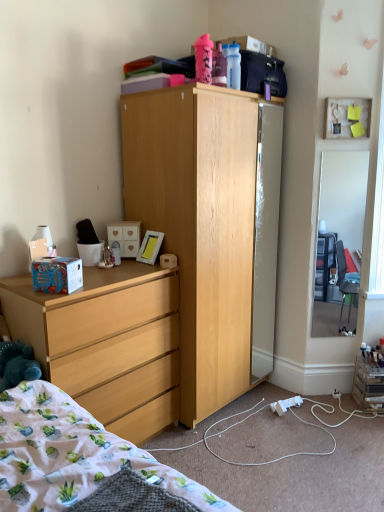
Question: In the image, is mirror glass refrigerator at center positioned in front of or behind blue cardboard box at left?

Choices:
 (A) front
 (B) behind

Answer: (B)

Question: In terms of width, does mirror glass refrigerator at center look wider or thinner when compared to blue cardboard box at left?

Choices:
 (A) wide
 (B) thin

Answer: (B)

Question: Estimate the real-world distances between objects in this image. Which object is farther from the velvety blue teddy bear at lower left?

Choices:
 (A) fluffy cotton blanket at lower left
 (B) clear glass mirror at right
 (C) white matte drawer at center
 (D) matte wood dresser at lower left
 (E) mirror glass refrigerator at center

Answer: (B)

Question: Which object is the closest to the mirror glass refrigerator at center?

Choices:
 (A) matte wood dresser at lower left
 (B) fluffy cotton blanket at lower left
 (C) matte white picture frame at upper right
 (D) white plastic power outlet at lower center
 (E) light wood cabinet at center

Answer: (C)